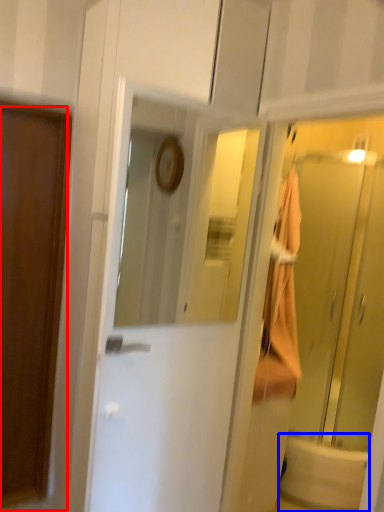
Question: Which object appears farthest to the camera in this image, door (highlighted by a red box) or bath (highlighted by a blue box)?

Choices:
 (A) door
 (B) bath

Answer: (B)